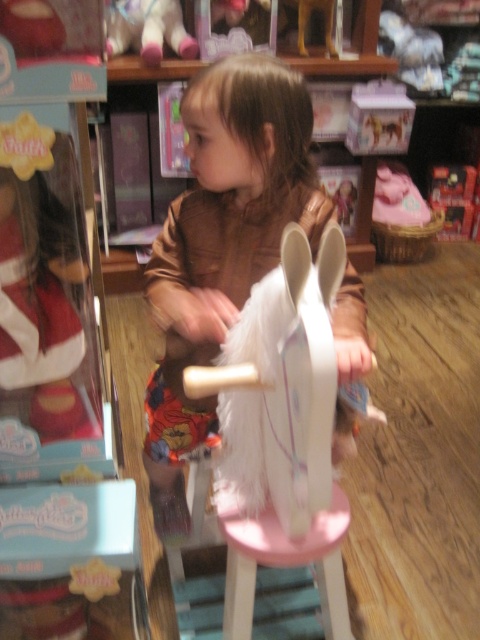
Question: Is brown plush jacket at center above pink wood stool at center?

Choices:
 (A) no
 (B) yes

Answer: (B)

Question: Which of the following is the closest to the observer?

Choices:
 (A) velvet plush bear at upper left
 (B) brown plush jacket at center
 (C) white furry horse at center
 (D) pink wood stool at center

Answer: (C)

Question: Can you confirm if white furry horse at center is positioned above pink wood stool at center?

Choices:
 (A) yes
 (B) no

Answer: (A)

Question: Estimate the real-world distances between objects in this image. Which object is closer to the white furry horse at center?

Choices:
 (A) velvet plush bear at upper left
 (B) pink wood stool at center
 (C) brown plush jacket at center

Answer: (C)

Question: Observing the image, what is the correct spatial positioning of pink wood stool at center in reference to velvet plush bear at upper left?

Choices:
 (A) right
 (B) left

Answer: (A)

Question: Estimate the real-world distances between objects in this image. Which object is farther from the white furry horse at center?

Choices:
 (A) pink wood stool at center
 (B) brown plush jacket at center
 (C) velvet plush bear at upper left

Answer: (C)